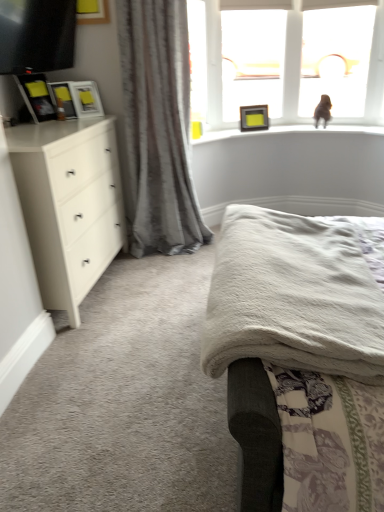
Question: Is matte black picture frame at left, arranged as the fourth picture frame when viewed from the back, bigger than matte white picture frame at upper left, the second picture frame from the right?

Choices:
 (A) yes
 (B) no

Answer: (A)

Question: Is matte black picture frame at left, placed as the first picture frame when sorted from left to right, not within matte white picture frame at upper left, which is the second picture frame from back to front?

Choices:
 (A) yes
 (B) no

Answer: (A)

Question: Does matte black picture frame at left, placed as the first picture frame when sorted from left to right, appear on the right side of matte white picture frame at upper left, marked as the third picture frame in a left-to-right arrangement?

Choices:
 (A) no
 (B) yes

Answer: (A)

Question: Is matte black picture frame at left, arranged as the fourth picture frame when viewed from the back, smaller than matte white picture frame at upper left, marked as the third picture frame in a left-to-right arrangement?

Choices:
 (A) yes
 (B) no

Answer: (B)

Question: Can you confirm if matte black picture frame at left, the 1th picture frame viewed from the front, is shorter than matte white picture frame at upper left, the second picture frame from the right?

Choices:
 (A) no
 (B) yes

Answer: (A)

Question: Is matte black picture frame at left, placed as the first picture frame when sorted from left to right, positioned in front of matte white picture frame at upper left, the second picture frame from the right?

Choices:
 (A) no
 (B) yes

Answer: (B)

Question: Does transparent glass window at upper right, placed as the first window screen when sorted from right to left, have a smaller size compared to matte black tv at upper left?

Choices:
 (A) no
 (B) yes

Answer: (B)

Question: Does transparent glass window at upper right, placed as the first window screen when sorted from right to left, have a lesser width compared to matte black tv at upper left?

Choices:
 (A) no
 (B) yes

Answer: (B)

Question: Is transparent glass window at upper right, the 2th window screen positioned from the left, positioned with its back to matte black tv at upper left?

Choices:
 (A) yes
 (B) no

Answer: (B)

Question: Considering the relative sizes of transparent glass window at upper right, placed as the first window screen when sorted from right to left, and matte black tv at upper left in the image provided, is transparent glass window at upper right, placed as the first window screen when sorted from right to left, bigger than matte black tv at upper left?

Choices:
 (A) yes
 (B) no

Answer: (B)

Question: Would you say transparent glass window at upper right, placed as the first window screen when sorted from right to left, contains matte black tv at upper left?

Choices:
 (A) yes
 (B) no

Answer: (B)

Question: From the image's perspective, is white soft bed at upper center on white matte chest of drawers at left?

Choices:
 (A) yes
 (B) no

Answer: (B)